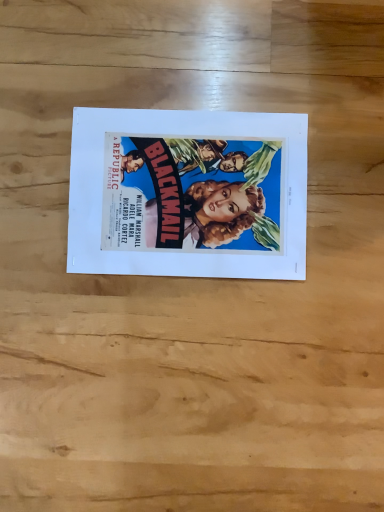
This screenshot has height=512, width=384. What do you see at coordinates (188, 194) in the screenshot? I see `matte paper poster at center` at bounding box center [188, 194].

Find the location of a particular element. matte paper poster at center is located at coordinates (188, 194).

What are the coordinates of `matte paper poster at center` in the screenshot? It's located at (188, 194).